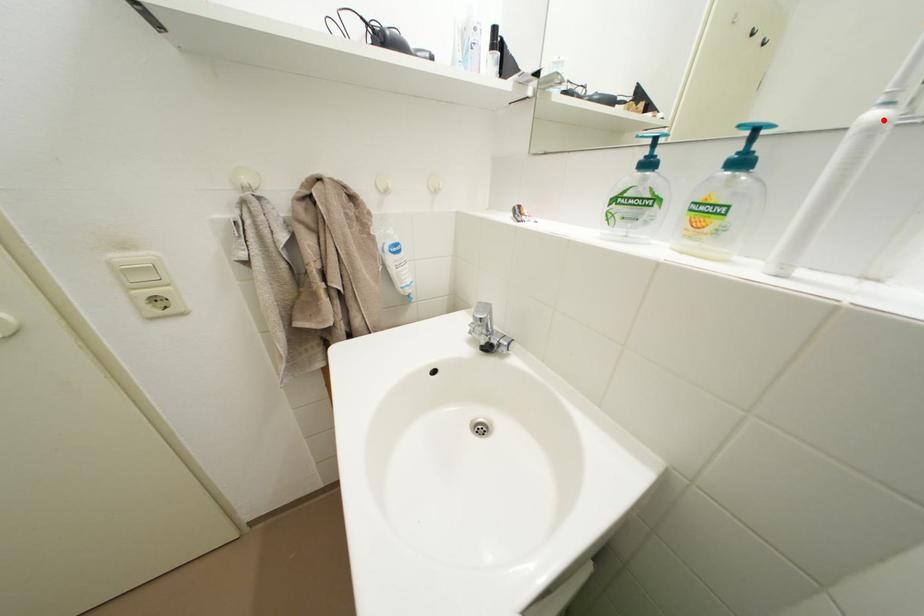
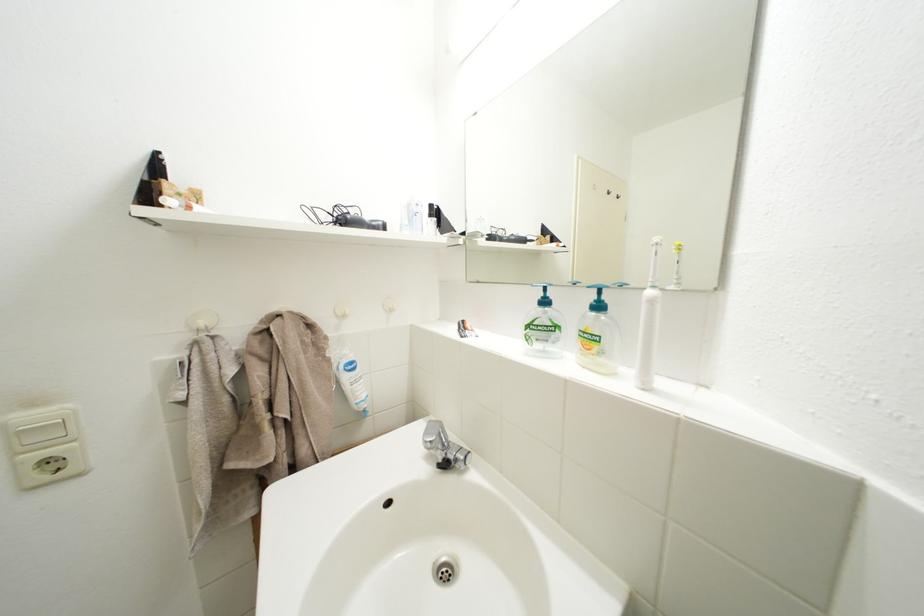
Where in the second image is the point corresponding to the highlighted location from the first image?

(659, 298)